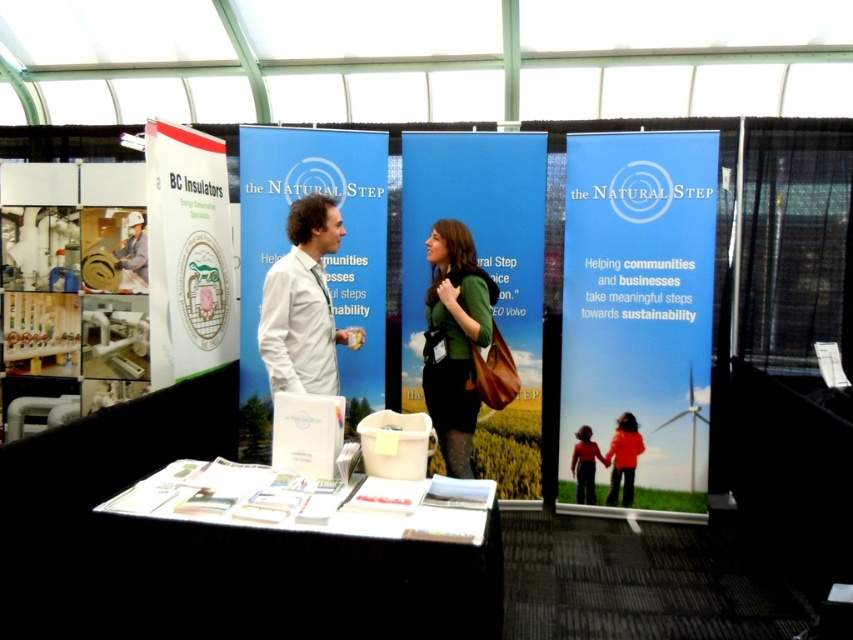
Question: In this image, where is blue paperboard sign at center located relative to green matte dress at center?

Choices:
 (A) left
 (B) right

Answer: (B)

Question: Which object is closer to the camera taking this photo?

Choices:
 (A) blue paperboard sign at center
 (B) green matte dress at center

Answer: (B)

Question: Among these objects, which one is nearest to the camera?

Choices:
 (A) green matte dress at center
 (B) blue paperboard sign at center
 (C) white shirt at center

Answer: (C)

Question: Which point is closer to the camera?

Choices:
 (A) blue paperboard sign at center
 (B) white shirt at center
 (C) green matte dress at center

Answer: (B)

Question: Can you confirm if blue paperboard sign at center is positioned to the right of green matte dress at center?

Choices:
 (A) no
 (B) yes

Answer: (B)

Question: Is blue paperboard sign at center to the left of white shirt at center from the viewer's perspective?

Choices:
 (A) yes
 (B) no

Answer: (B)